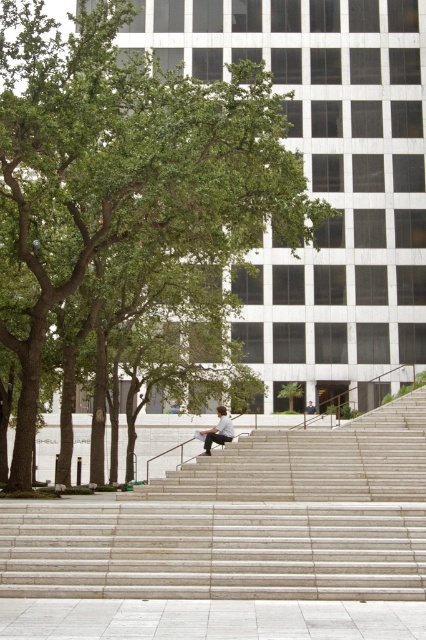
Question: Where is green leafy tree at center located in relation to light brown wooden skateboard at center in the image?

Choices:
 (A) right
 (B) left

Answer: (B)

Question: Which object is closer to the camera taking this photo?

Choices:
 (A) green leafy tree at center
 (B) light brown wooden skateboard at center
 (C) smooth concrete stairs at center

Answer: (C)

Question: Estimate the real-world distances between objects in this image. Which object is closer to the light brown wooden skateboard at center?

Choices:
 (A) smooth concrete stairs at center
 (B) green leafy tree at center

Answer: (A)

Question: Which is farther from the smooth concrete stairs at center?

Choices:
 (A) light brown wooden skateboard at center
 (B) green leafy tree at center

Answer: (B)

Question: Considering the relative positions of smooth concrete stairs at center and light brown wooden skateboard at center in the image provided, where is smooth concrete stairs at center located with respect to light brown wooden skateboard at center?

Choices:
 (A) below
 (B) above

Answer: (B)

Question: Can you confirm if green leafy tree at center is positioned above smooth concrete stairs at center?

Choices:
 (A) yes
 (B) no

Answer: (A)